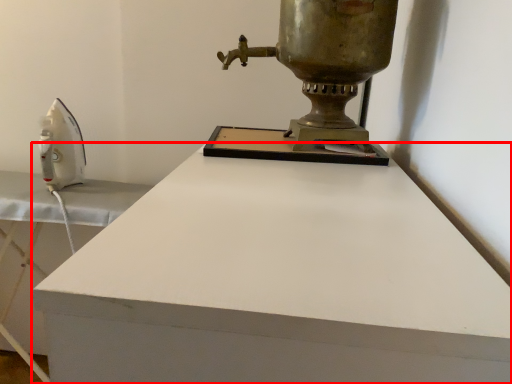
Question: From the image's perspective, what is the correct spatial positioning of desk (annotated by the red box) in reference to sewing machine?

Choices:
 (A) below
 (B) above

Answer: (A)